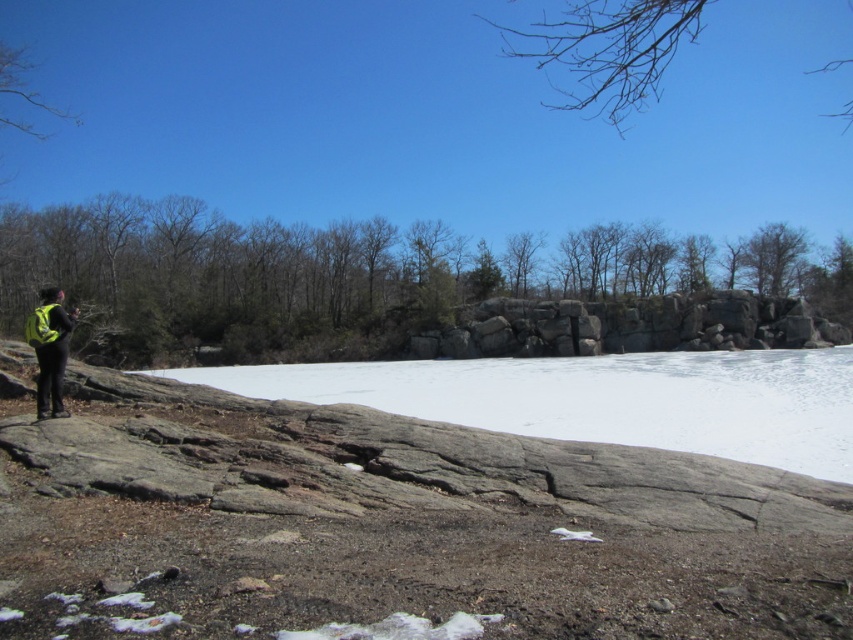
You are planning to place the neon yellow backpack at left on the white matte snow at center. Based on their sizes, will the backpack fit entirely on the snow without hanging over?

The white matte snow at center might be wider than neon yellow backpack at left, so there is a possibility that the backpack will fit, but it is uncertain without exact measurements.